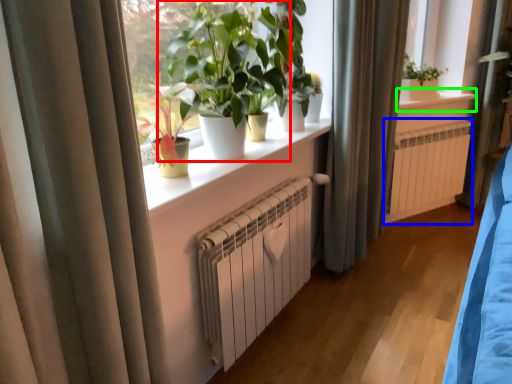
Question: Which object is the farthest from houseplant (highlighted by a red box)? Choose among these: air conditioning (highlighted by a blue box) or window sill (highlighted by a green box).

Choices:
 (A) air conditioning
 (B) window sill

Answer: (B)